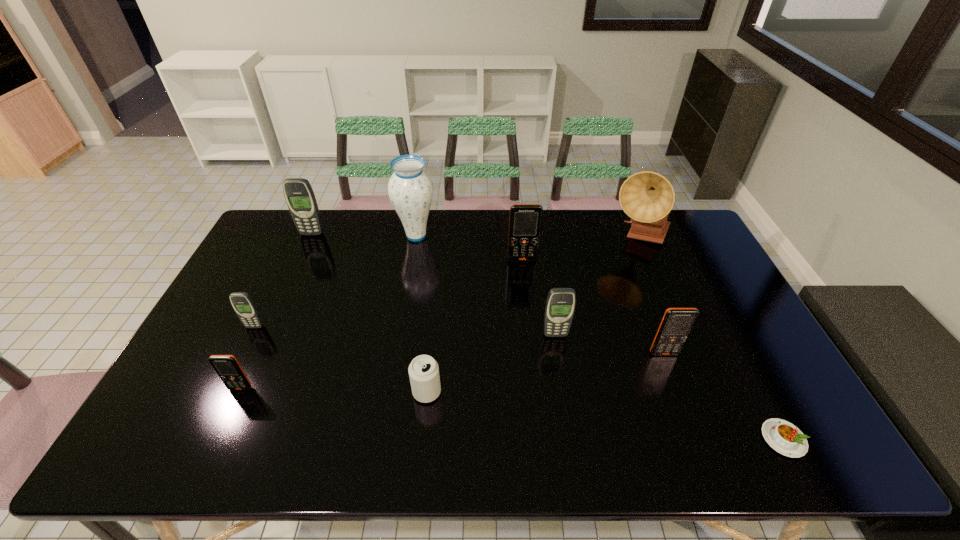
You are a GUI agent. You are given a task and a screenshot of the screen. Output one action in this format:
    pyautogui.click(x=<x>, y=<y>)
    Task: Click on the free space between the second nearest orange cellular telephone and the fourth nearest cellular telephone
    
    Given the screenshot: What is the action you would take?
    pyautogui.click(x=460, y=340)

The width and height of the screenshot is (960, 540). In order to click on free spot between the leftmost orange cellular telephone and the ninth tallest object in this screenshot , I will do `click(334, 390)`.

I want to click on vacant area between the second nearest gray cellular telephone and the nearest object, so click(x=519, y=383).

Locate an element on the screen. Image resolution: width=960 pixels, height=540 pixels. empty space between the rightmost cellular telephone and the seventh nearest object is located at coordinates (593, 307).

Image resolution: width=960 pixels, height=540 pixels. What are the coordinates of `free space between the nearest object and the rightmost cellular telephone` in the screenshot? It's located at (724, 396).

Find the location of a particular element. The height and width of the screenshot is (540, 960). free spot between the phonograph record and the leftmost orange cellular telephone is located at coordinates click(441, 313).

What are the coordinates of `free space between the third farthest cellular telephone and the second biggest gray cellular telephone` in the screenshot? It's located at (405, 330).

The width and height of the screenshot is (960, 540). Find the location of `empty space between the sixth nearest object and the fifth nearest cellular telephone`. empty space between the sixth nearest object and the fifth nearest cellular telephone is located at coordinates [x=389, y=293].

Locate an element on the screen. The height and width of the screenshot is (540, 960). free spot between the vase and the farthest gray cellular telephone is located at coordinates (364, 235).

Where is `vacant area between the vase and the nearest object`? This screenshot has height=540, width=960. vacant area between the vase and the nearest object is located at coordinates (600, 338).